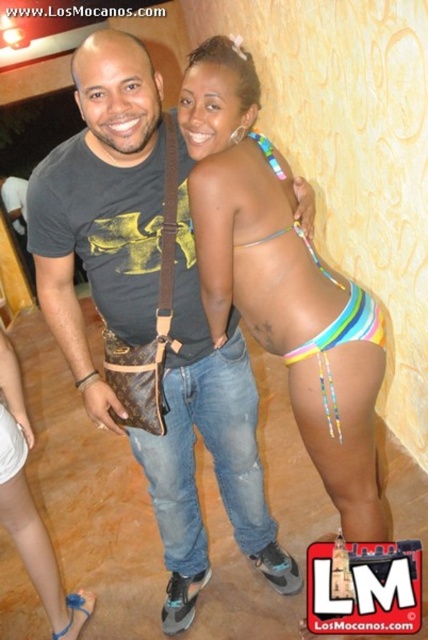
Does matte black t-shirt at center have a lesser height compared to white fabric underwear at lower left?

No.

Which is more to the left, matte black t-shirt at center or white fabric underwear at lower left?

Positioned to the left is white fabric underwear at lower left.

This screenshot has height=640, width=428. Find the location of `matte black t-shirt at center`. matte black t-shirt at center is located at coordinates (148, 316).

Is matte black t-shirt at center to the left of white fabric skirt at lower left from the viewer's perspective?

In fact, matte black t-shirt at center is to the right of white fabric skirt at lower left.

Who is more forward, (171, 536) or (56, 566)?

Point (171, 536)

Who is more distant from viewer, (x=172, y=556) or (x=8, y=474)?

The point (x=172, y=556) is behind.

At what (x,y) coordinates should I click in order to perform the action: click on matte black t-shirt at center. Please return your answer as a coordinate pair (x, y). Looking at the image, I should click on (148, 316).

Is multicolored bikini bottom at center above blue fabric sandal at lower left?

Indeed, multicolored bikini bottom at center is positioned over blue fabric sandal at lower left.

Which is behind, point (270, 260) or point (68, 627)?

Positioned behind is point (68, 627).

Locate an element on the screen. multicolored bikini bottom at center is located at coordinates (282, 282).